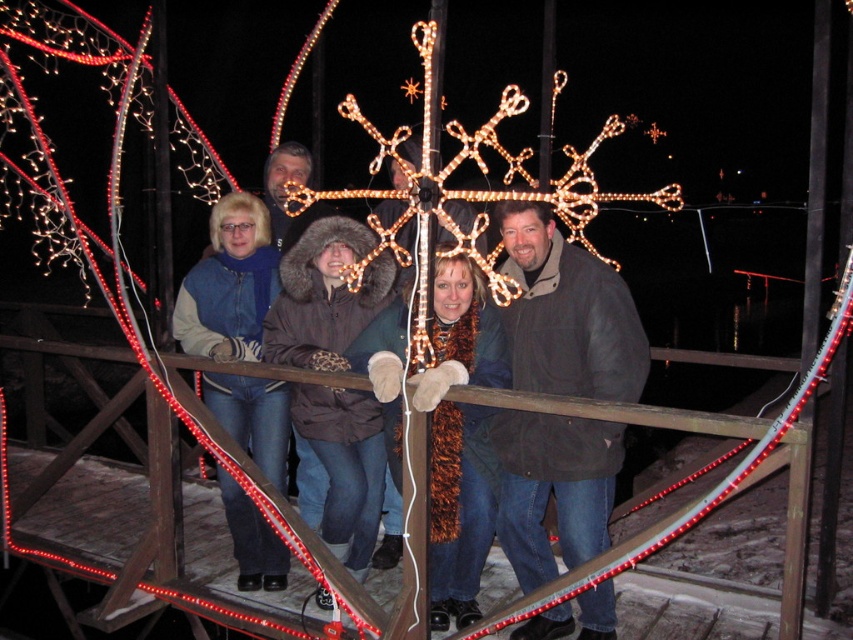
Based on the scene description, where is the dark brown jacket at center located in the image?

The dark brown jacket at center is located at point coordinates of (567, 314).